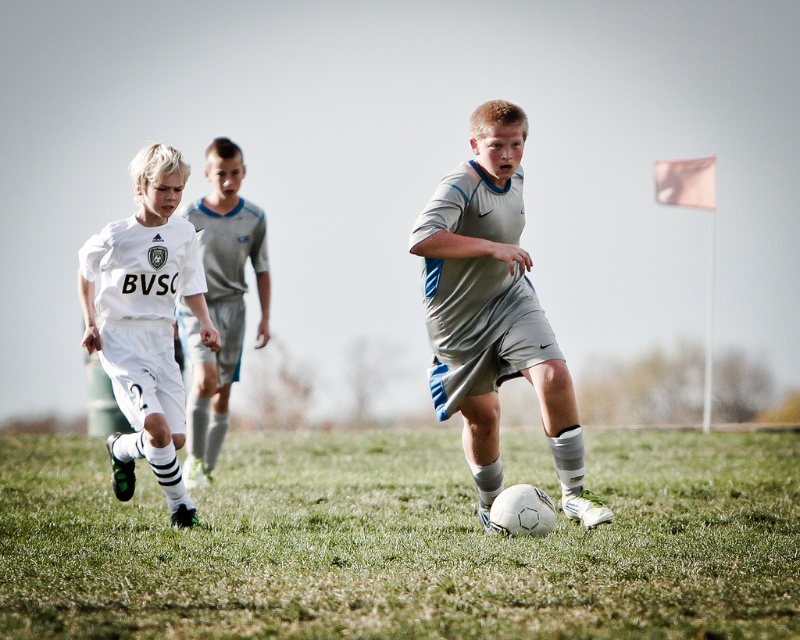
Question: Where is green grass at center located in relation to white matte soccer jersey at left in the image?

Choices:
 (A) below
 (B) above

Answer: (A)

Question: Is green grass at center wider than white matte soccer uniform at left?

Choices:
 (A) no
 (B) yes

Answer: (B)

Question: Which of the following is the closest to the observer?

Choices:
 (A) (168, 454)
 (B) (194, 422)

Answer: (A)

Question: Which of the following is the farthest from the observer?

Choices:
 (A) (100, 268)
 (B) (454, 515)

Answer: (B)

Question: Is white matte soccer uniform at left to the left of white matte soccer jersey at left from the viewer's perspective?

Choices:
 (A) yes
 (B) no

Answer: (A)

Question: Which of these objects is positioned closest to the white matte soccer uniform at left?

Choices:
 (A) green grass at center
 (B) white matte soccer jersey at left
 (C) gray matte shorts at center

Answer: (C)